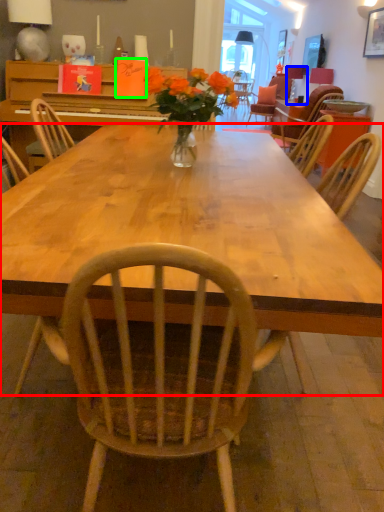
Question: Which object is positioned closest to desk (highlighted by a red box)? Select from lamp (highlighted by a blue box) and book (highlighted by a green box).

Choices:
 (A) lamp
 (B) book

Answer: (B)